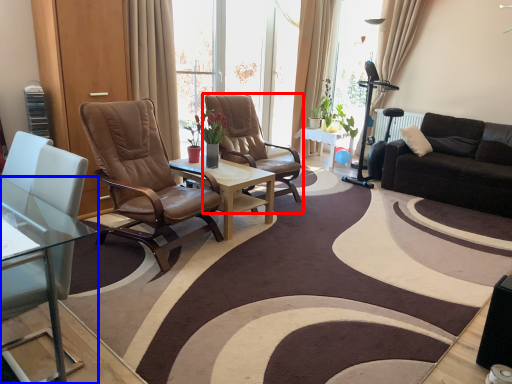
Question: Which point is further to the camera, chair (highlighted by a red box) or coffee table (highlighted by a blue box)?

Choices:
 (A) chair
 (B) coffee table

Answer: (A)